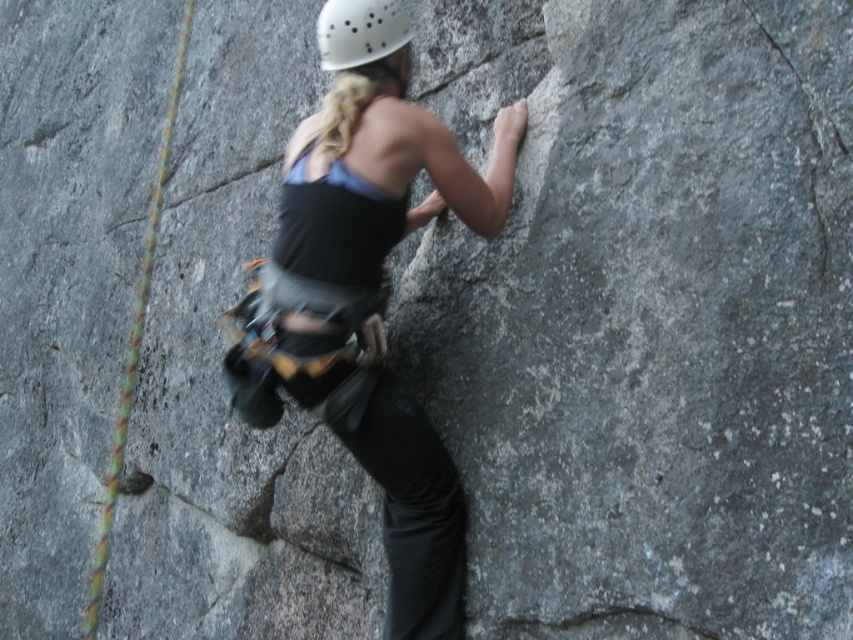
Question: Which of these objects is positioned closest to the yellow-green braided rope at left?

Choices:
 (A) matte black tank top at center
 (B) white matte helmet at upper center

Answer: (A)

Question: Estimate the real-world distances between objects in this image. Which object is closer to the white matte helmet at upper center?

Choices:
 (A) matte black tank top at center
 (B) yellow-green braided rope at left

Answer: (A)

Question: Which of the following is the farthest from the observer?

Choices:
 (A) white matte helmet at upper center
 (B) yellow-green braided rope at left

Answer: (B)

Question: Can you confirm if yellow-green braided rope at left is thinner than white matte helmet at upper center?

Choices:
 (A) no
 (B) yes

Answer: (A)

Question: Does matte black tank top at center have a smaller size compared to yellow-green braided rope at left?

Choices:
 (A) yes
 (B) no

Answer: (A)

Question: Does matte black tank top at center have a larger size compared to yellow-green braided rope at left?

Choices:
 (A) no
 (B) yes

Answer: (A)